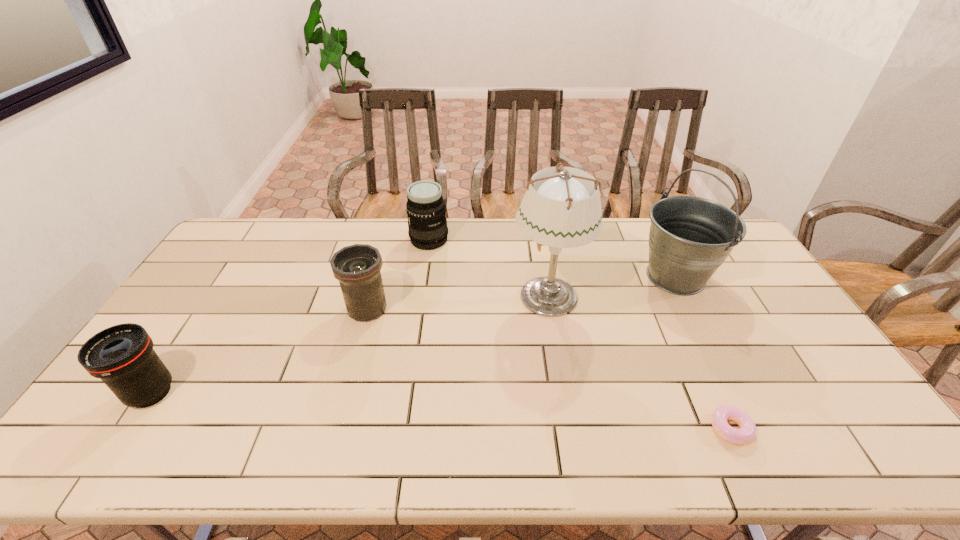
Image resolution: width=960 pixels, height=540 pixels. Find the location of `vacant space located on the lampshade of the lampshade`. vacant space located on the lampshade of the lampshade is located at coordinates (429, 295).

Where is `vacant area situated on the lampshade of the lampshade`? vacant area situated on the lampshade of the lampshade is located at coordinates (429, 295).

Locate an element on the screen. The image size is (960, 540). vacant space situated 0.060m on the front of the bucket is located at coordinates (697, 320).

This screenshot has width=960, height=540. Find the location of `blank area located 0.300m on the left of the rightmost telephoto lens`. blank area located 0.300m on the left of the rightmost telephoto lens is located at coordinates (328, 240).

Locate an element on the screen. The image size is (960, 540). vacant space located on the left of the second farthest telephoto lens is located at coordinates (248, 309).

Locate an element on the screen. blank space located on the back of the leftmost telephoto lens is located at coordinates (185, 340).

The width and height of the screenshot is (960, 540). What are the coordinates of `blank space located 0.400m on the left of the doughnut` in the screenshot? It's located at (544, 428).

What are the coordinates of `bucket positioned at the far edge` in the screenshot? It's located at (690, 237).

Locate an element on the screen. The height and width of the screenshot is (540, 960). telephoto lens situated at the far edge is located at coordinates (426, 211).

Identify the location of object positioned at the near edge. (747, 431).